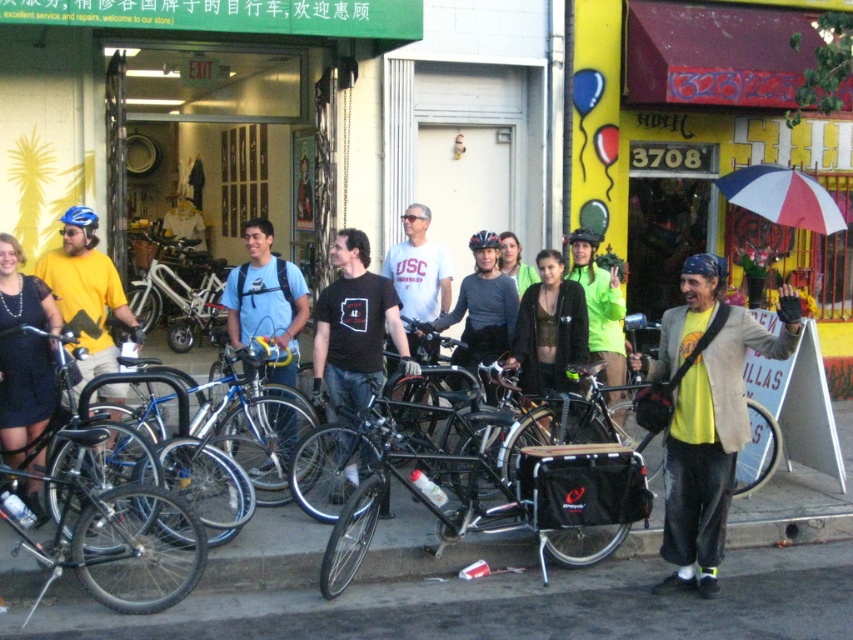
Does blue t-shirt at center come in front of gray matte shirt at center?

Yes, it is.

Who is higher up, blue t-shirt at center or gray matte shirt at center?

blue t-shirt at center is higher up.

You are a GUI agent. You are given a task and a screenshot of the screen. Output one action in this format:
    pyautogui.click(x=<x>, y=<y>)
    Task: Click on the blue t-shirt at center
    Image resolution: width=853 pixels, height=640 pixels.
    Given the screenshot: What is the action you would take?
    pyautogui.click(x=265, y=300)

Between metallic gold jacket at center and white matte t-shirt at center, which one has less height?

Standing shorter between the two is metallic gold jacket at center.

Who is higher up, metallic gold jacket at center or white matte t-shirt at center?

Positioned higher is white matte t-shirt at center.

Image resolution: width=853 pixels, height=640 pixels. I want to click on metallic gold jacket at center, so click(549, 328).

Is concrete pavement at center bigger than metallic gold jacket at center?

Yes, concrete pavement at center is bigger than metallic gold jacket at center.

Can you confirm if concrete pavement at center is thinner than metallic gold jacket at center?

No, concrete pavement at center is not thinner than metallic gold jacket at center.

Locate an element on the screen. The width and height of the screenshot is (853, 640). concrete pavement at center is located at coordinates (494, 580).

At what (x,y) coordinates should I click in order to perform the action: click on concrete pavement at center. Please return your answer as a coordinate pair (x, y). Looking at the image, I should click on (494, 580).